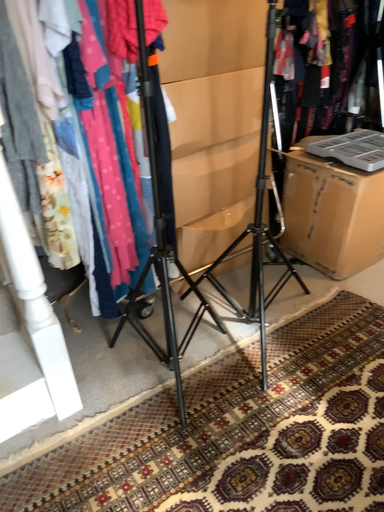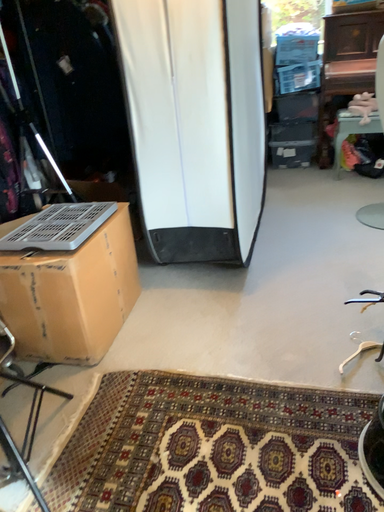
Question: Which way did the camera rotate in the video?

Choices:
 (A) rotated left
 (B) rotated right

Answer: (B)